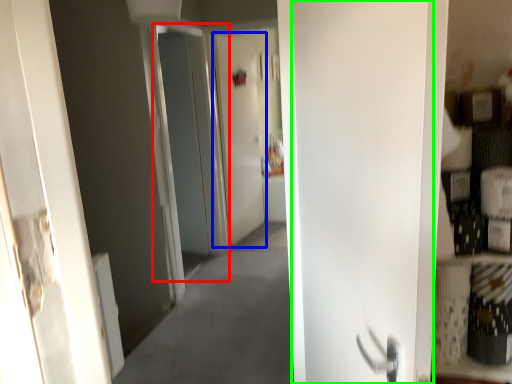
Question: Which is nearer to the screen door (highlighted by a red box)? screen door (highlighted by a blue box) or door (highlighted by a green box).

Choices:
 (A) screen door
 (B) door

Answer: (A)